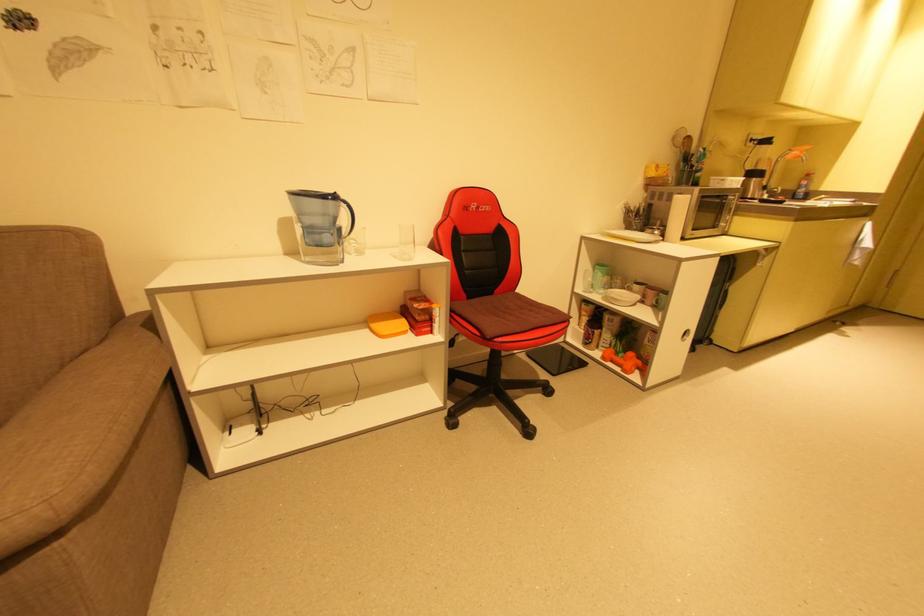
The width and height of the screenshot is (924, 616). I want to click on sofa sitting surface, so click(x=81, y=429).